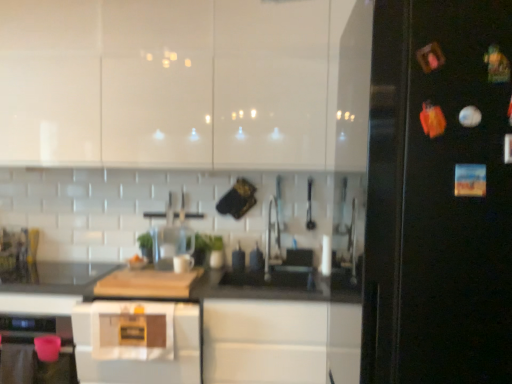
Question: Does white glossy cabinets at upper center come in front of black matte countertop at center?

Choices:
 (A) no
 (B) yes

Answer: (A)

Question: From the image's perspective, does white glossy cabinets at upper center appear higher than black matte countertop at center?

Choices:
 (A) no
 (B) yes

Answer: (B)

Question: Is white glossy cabinets at upper center oriented away from black matte countertop at center?

Choices:
 (A) yes
 (B) no

Answer: (B)

Question: Is white glossy cabinets at upper center behind black matte countertop at center?

Choices:
 (A) no
 (B) yes

Answer: (B)

Question: Is white glossy cabinets at upper center directly adjacent to black matte countertop at center?

Choices:
 (A) yes
 (B) no

Answer: (B)

Question: In terms of width, does black matte countertop at center look wider or thinner when compared to clear glass blender at center?

Choices:
 (A) thin
 (B) wide

Answer: (B)

Question: Would you say black matte countertop at center is to the left or to the right of clear glass blender at center in the picture?

Choices:
 (A) left
 (B) right

Answer: (A)

Question: In terms of height, does black matte countertop at center look taller or shorter compared to clear glass blender at center?

Choices:
 (A) tall
 (B) short

Answer: (A)

Question: In terms of size, does black matte countertop at center appear bigger or smaller than clear glass blender at center?

Choices:
 (A) big
 (B) small

Answer: (A)

Question: In terms of width, does black glossy fridge at right look wider or thinner when compared to white glossy cabinets at upper center?

Choices:
 (A) thin
 (B) wide

Answer: (B)

Question: Is black glossy fridge at right spatially inside white glossy cabinets at upper center, or outside of it?

Choices:
 (A) outside
 (B) inside

Answer: (A)

Question: Relative to white glossy cabinets at upper center, is black glossy fridge at right in front or behind?

Choices:
 (A) front
 (B) behind

Answer: (A)

Question: Is point (392, 354) positioned closer to the camera than point (222, 99)?

Choices:
 (A) farther
 (B) closer

Answer: (B)

Question: Is clear glass blender at center inside or outside of black glossy fridge at right?

Choices:
 (A) outside
 (B) inside

Answer: (A)

Question: Is clear glass blender at center wider or thinner than black glossy fridge at right?

Choices:
 (A) wide
 (B) thin

Answer: (B)